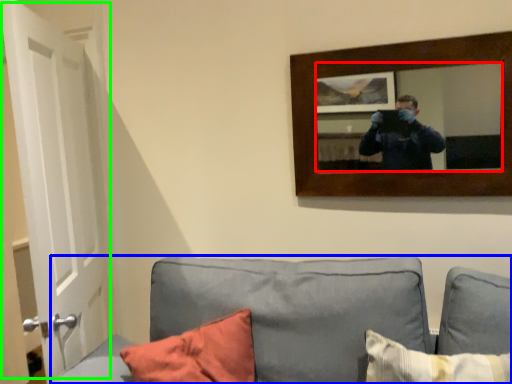
Question: Considering the real-world distances, which object is farthest from mirror (highlighted by a red box)? studio couch (highlighted by a blue box) or door (highlighted by a green box)?

Choices:
 (A) studio couch
 (B) door

Answer: (B)